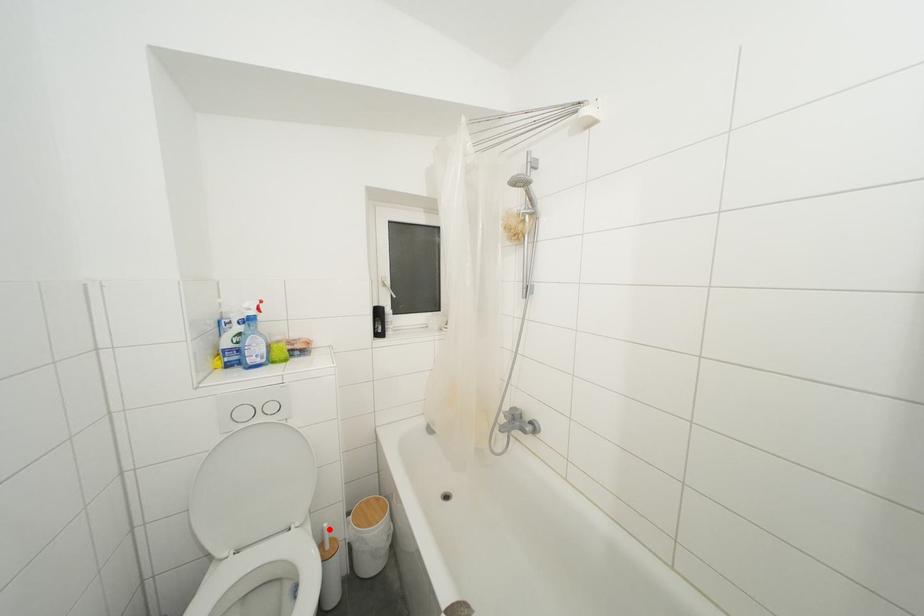
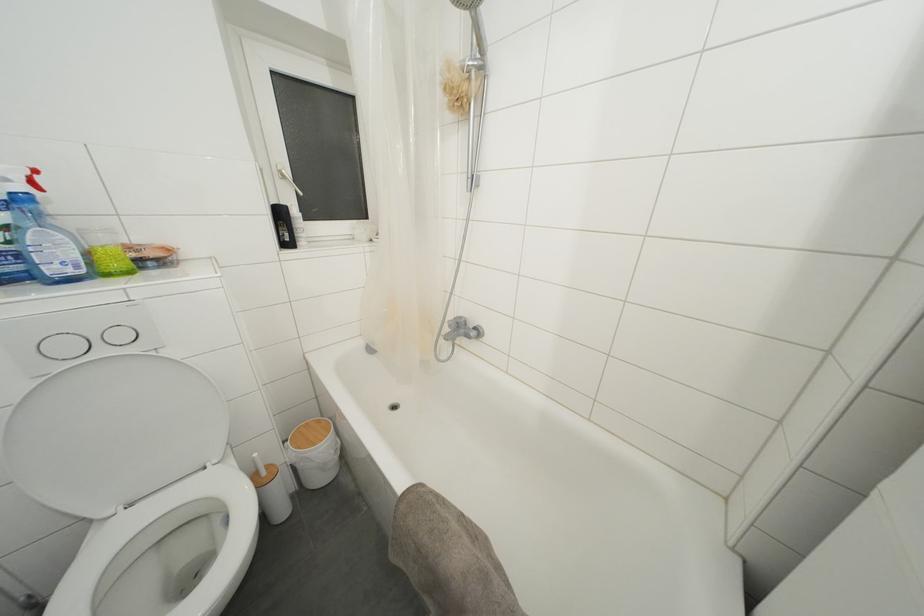
The point at the highlighted location is marked in the first image. Where is the corresponding point in the second image?

(260, 459)